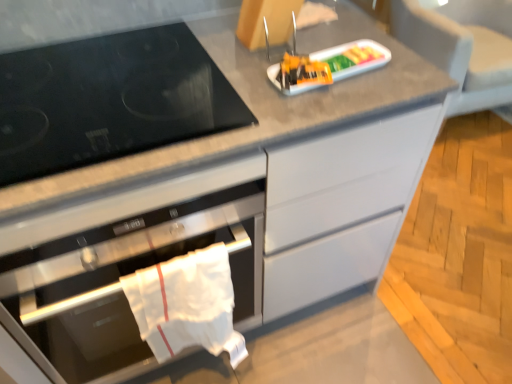
Find the location of a particular element. This screenshot has height=384, width=512. blank space to the left of plastic tray at center is located at coordinates (234, 64).